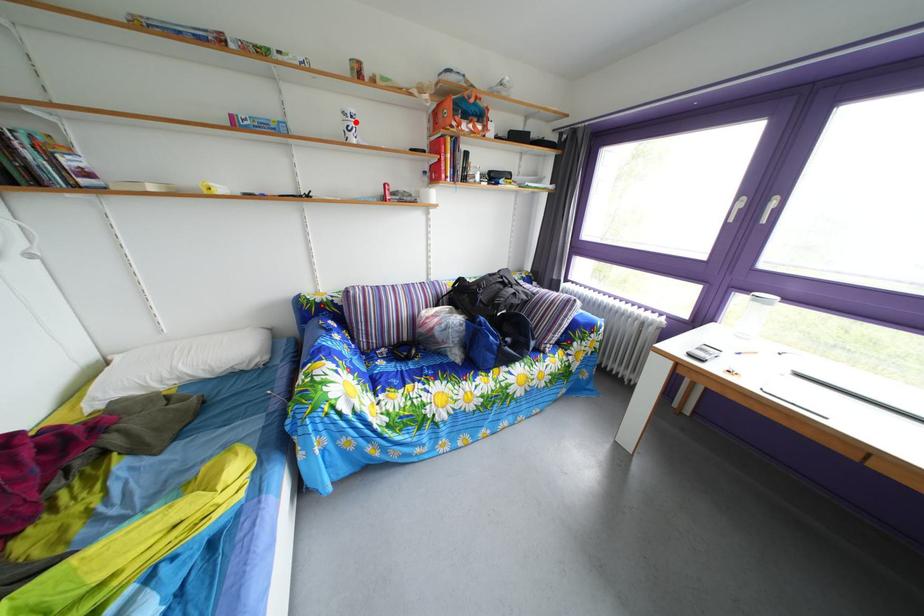
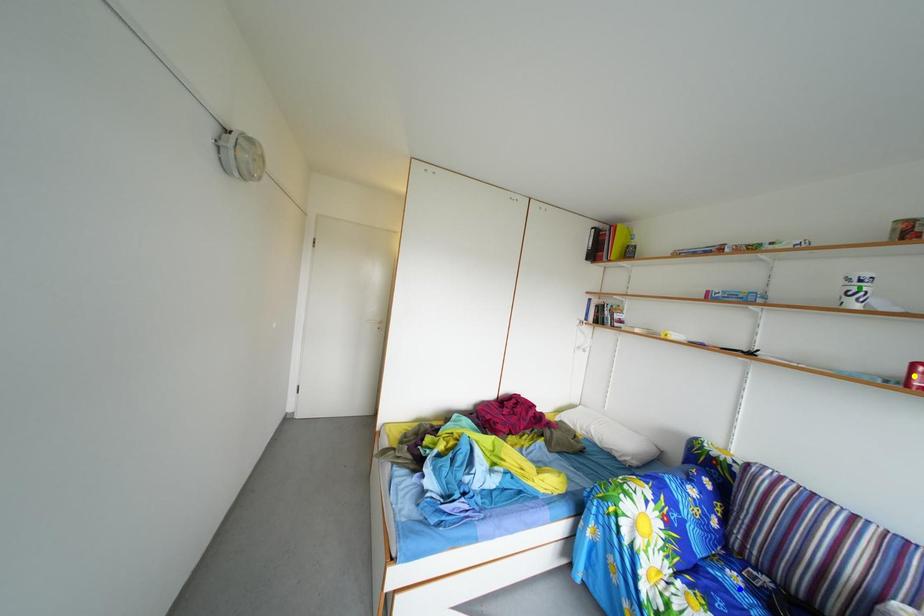
Question: I am providing you with two images of the same scene from different viewpoints. A red point is marked on the first image. You are given multiple points on the second image. Which mark in image 2 goes with the point in image 1?

Choices:
 (A) blue point
 (B) green point
 (C) yellow point

Answer: (B)